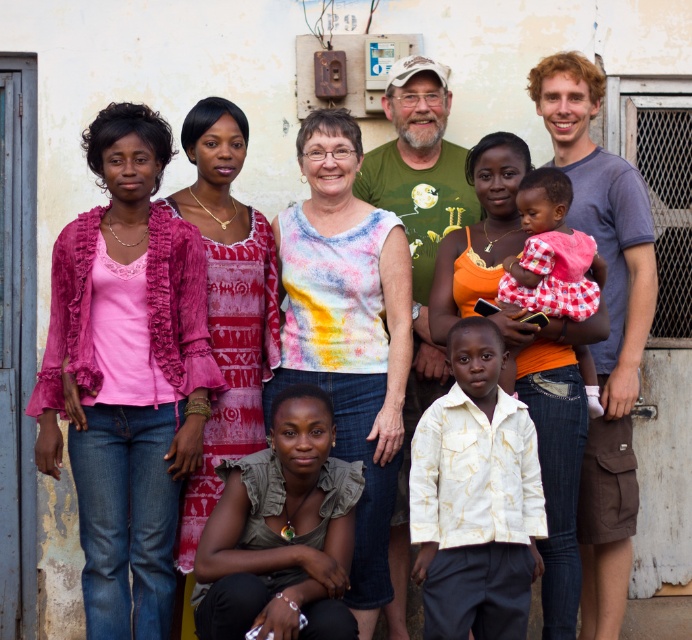
Which is above, green textured t-shirt at center or red checkered dress at center?

red checkered dress at center

Image resolution: width=692 pixels, height=640 pixels. Identify the location of green textured t-shirt at center. (417, 252).

You are a GUI agent. You are given a task and a screenshot of the screen. Output one action in this format:
    pyautogui.click(x=<x>, y=<y>)
    Task: Click on the green textured t-shirt at center
    
    Given the screenshot: What is the action you would take?
    pyautogui.click(x=417, y=252)

Where is `white printed shirt at center`? The width and height of the screenshot is (692, 640). white printed shirt at center is located at coordinates (475, 497).

In the scene shown: How distant is white printed shirt at center from red checkered dress at center?

The distance of white printed shirt at center from red checkered dress at center is 3.78 feet.

Where is `white printed shirt at center`? Image resolution: width=692 pixels, height=640 pixels. white printed shirt at center is located at coordinates (475, 497).

Is tie-dye fabric shirt at center bigger than white printed shirt at center?

Yes.

Which is above, tie-dye fabric shirt at center or white printed shirt at center?

tie-dye fabric shirt at center is higher up.

Is point (311, 323) positioned after point (480, 365)?

Yes, point (311, 323) is farther from viewer.

Locate an element on the screen. The image size is (692, 640). tie-dye fabric shirt at center is located at coordinates (347, 332).